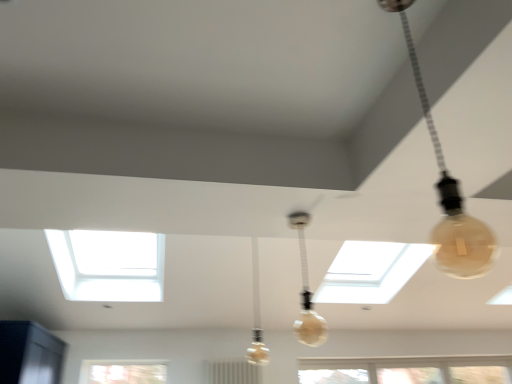
Question: In which direction should I rotate to look at translucent glass bulb at center, which is counted as the third lamp, starting from the top?

Choices:
 (A) right
 (B) left

Answer: (A)

Question: From a real-world perspective, is translucent glass bulb at center, the 2th lamp positioned from the left, below translucent glass bulb at center, which is counted as the third lamp, starting from the top?

Choices:
 (A) no
 (B) yes

Answer: (B)

Question: Is translucent glass bulb at center, acting as the second lamp starting from the back, behind translucent glass bulb at center, which is the 3th lamp from right to left?

Choices:
 (A) yes
 (B) no

Answer: (B)

Question: Is translucent glass bulb at center, acting as the second lamp starting from the right, surrounding translucent glass bulb at center, which is the 3th lamp from right to left?

Choices:
 (A) yes
 (B) no

Answer: (B)

Question: Can you confirm if translucent glass bulb at center, placed as the second lamp when sorted from bottom to top, is positioned to the left of translucent glass bulb at center, which ranks as the first lamp in left-to-right order?

Choices:
 (A) yes
 (B) no

Answer: (B)

Question: Is the surface of translucent glass bulb at center, acting as the second lamp starting from the right, in direct contact with translucent glass bulb at center, the third lamp viewed from the front?

Choices:
 (A) yes
 (B) no

Answer: (B)

Question: Is translucent glass bulb at center, placed as the second lamp when sorted from bottom to top, shorter than translucent glass bulb at center, which is counted as the third lamp, starting from the top?

Choices:
 (A) yes
 (B) no

Answer: (A)

Question: Can you confirm if translucent glass bulb at upper right, arranged as the 3th lamp when ordered from the bottom, is bigger than translucent glass bulb at center, the 2th lamp positioned from the left?

Choices:
 (A) yes
 (B) no

Answer: (A)

Question: Is translucent glass bulb at upper right, the first lamp positioned from the right, outside of translucent glass bulb at center, the 2th lamp in the front-to-back sequence?

Choices:
 (A) yes
 (B) no

Answer: (A)

Question: Is translucent glass bulb at center, acting as the 2th lamp starting from the top, a part of translucent glass bulb at upper right, which is counted as the 3th lamp, starting from the left?

Choices:
 (A) no
 (B) yes

Answer: (A)

Question: Is translucent glass bulb at upper right, which is the first lamp from top to bottom, wider than translucent glass bulb at center, acting as the second lamp starting from the back?

Choices:
 (A) yes
 (B) no

Answer: (A)

Question: Considering the relative positions of translucent glass bulb at upper right, which is the first lamp from top to bottom, and translucent glass bulb at center, acting as the 2th lamp starting from the top, in the image provided, is translucent glass bulb at upper right, which is the first lamp from top to bottom, to the right of translucent glass bulb at center, acting as the 2th lamp starting from the top, from the viewer's perspective?

Choices:
 (A) no
 (B) yes

Answer: (B)

Question: Can you confirm if translucent glass bulb at upper right, the first lamp positioned from the right, is thinner than translucent glass bulb at center, the 2th lamp positioned from the left?

Choices:
 (A) no
 (B) yes

Answer: (A)

Question: Does translucent glass bulb at center, placed as the 1th lamp when sorted from back to front, have a lesser height compared to translucent glass bulb at upper right, the first lamp positioned from the right?

Choices:
 (A) no
 (B) yes

Answer: (A)